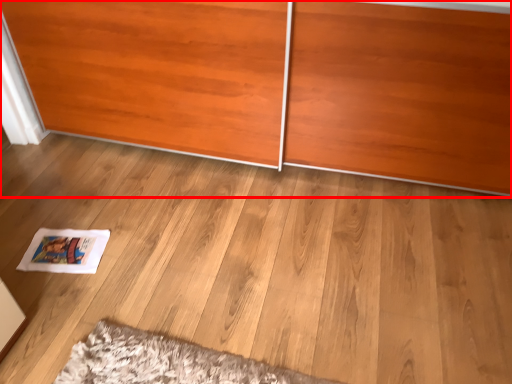
Question: From the image's perspective, what is the correct spatial positioning of furniture (annotated by the red box) in reference to magazine?

Choices:
 (A) above
 (B) below

Answer: (A)